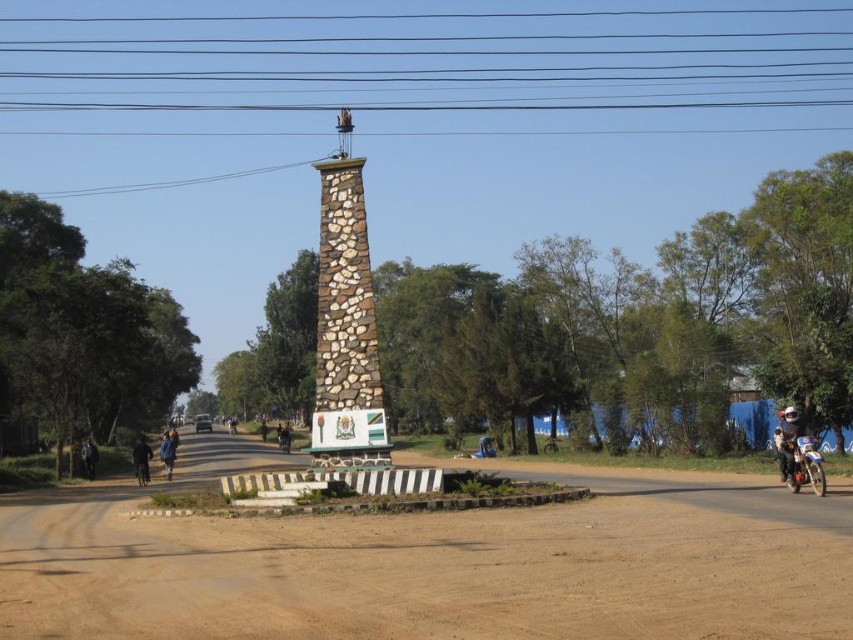
Question: Does brown sandy dirt field at center appear over white glossy helmet at upper right?

Choices:
 (A) no
 (B) yes

Answer: (A)

Question: Which is farther from the brown sandy dirt field at center?

Choices:
 (A) brown stone tower at center
 (B) blue fabric jacket at center
 (C) white glossy helmet at upper right

Answer: (B)

Question: Which of the following is the farthest from the observer?

Choices:
 (A) (109, 596)
 (B) (791, 432)
 (C) (358, 296)
 (D) (171, 444)

Answer: (D)

Question: Does brown sandy dirt field at center lie in front of brown stone tower at center?

Choices:
 (A) yes
 (B) no

Answer: (A)

Question: Does brown stone tower at center come in front of white glossy helmet at upper right?

Choices:
 (A) no
 (B) yes

Answer: (A)

Question: Which object is the closest to the brown stone tower at center?

Choices:
 (A) brown sandy dirt field at center
 (B) white glossy helmet at upper right

Answer: (A)